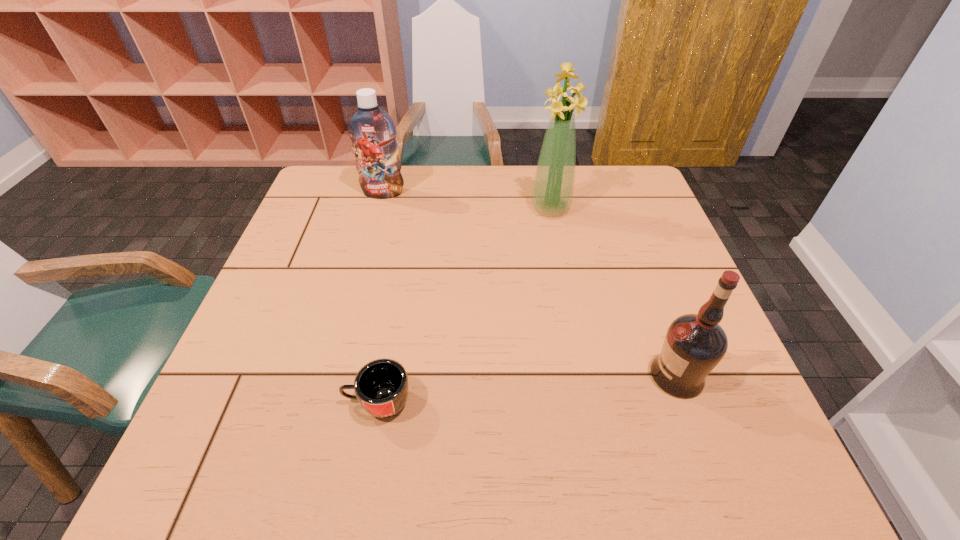
Find the location of a particular element. vacant space at the far right corner of the desktop is located at coordinates (592, 168).

In order to click on vacant area between the second object from right to left and the liquor in this screenshot , I will do `click(613, 293)`.

Find the location of a particular element. vacant area between the tallest object and the rightmost object is located at coordinates (613, 293).

Identify the location of empty space between the bouquet and the shampoo. (467, 201).

The image size is (960, 540). What are the coordinates of `vacant area between the shampoo and the liquor` in the screenshot? It's located at (530, 284).

Where is `vacant region between the rightmost object and the shampoo`? The height and width of the screenshot is (540, 960). vacant region between the rightmost object and the shampoo is located at coordinates (530, 284).

Find the location of `unoccupied position between the bouquet and the shampoo`. unoccupied position between the bouquet and the shampoo is located at coordinates (467, 201).

Image resolution: width=960 pixels, height=540 pixels. In order to click on unoccupied area between the shortest object and the shampoo in this screenshot , I will do `click(380, 297)`.

Where is `free space between the shampoo and the tallest object`? The height and width of the screenshot is (540, 960). free space between the shampoo and the tallest object is located at coordinates (467, 201).

You are a GUI agent. You are given a task and a screenshot of the screen. Output one action in this format:
    pyautogui.click(x=<x>, y=<y>)
    Task: Click on the vacant area between the tallest object and the shampoo
    
    Given the screenshot: What is the action you would take?
    pyautogui.click(x=467, y=201)